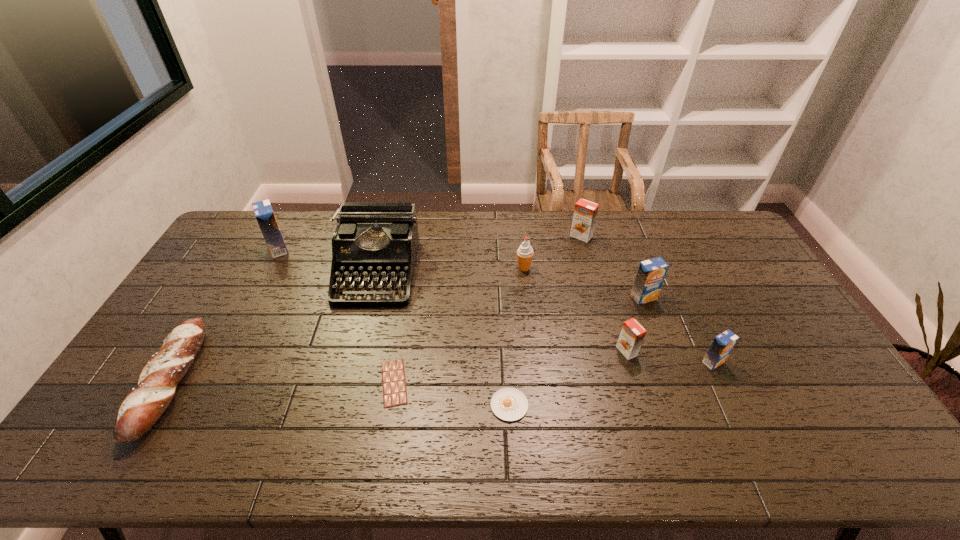
Where is `free space that is in between the second blue orange_juice from left to right and the typewriter`? Image resolution: width=960 pixels, height=540 pixels. free space that is in between the second blue orange_juice from left to right and the typewriter is located at coordinates (510, 285).

Find the location of a particular element. The width and height of the screenshot is (960, 540). object that is the ninth closest to the third farthest orange juice is located at coordinates (140, 410).

Where is `the seventh closest object to the eighth tallest object`? Image resolution: width=960 pixels, height=540 pixels. the seventh closest object to the eighth tallest object is located at coordinates (585, 212).

Find the location of a particular element. The height and width of the screenshot is (540, 960). orange juice object that ranks as the third closest to the ninth object from right to left is located at coordinates (651, 273).

Select which orange juice appears as the fourth closest to the black typewriter. Please provide its 2D coordinates. Your answer should be formatted as a tuple, i.e. [(x, y)], where the tuple contains the x and y coordinates of a point satisfying the conditions above.

[(651, 273)]

This screenshot has height=540, width=960. Find the location of `blue orange_juice that is the second closest one to the nearest blue orange_juice`. blue orange_juice that is the second closest one to the nearest blue orange_juice is located at coordinates (263, 211).

This screenshot has width=960, height=540. Find the location of `blue orange_juice that is the closest one to the third nearest orange juice`. blue orange_juice that is the closest one to the third nearest orange juice is located at coordinates (722, 345).

Identify the location of vacant area in the image that satisfies the following two spatial constraints: 1. on the typing side of the chocolate bar; 2. on the left side of the typewriter. (348, 383).